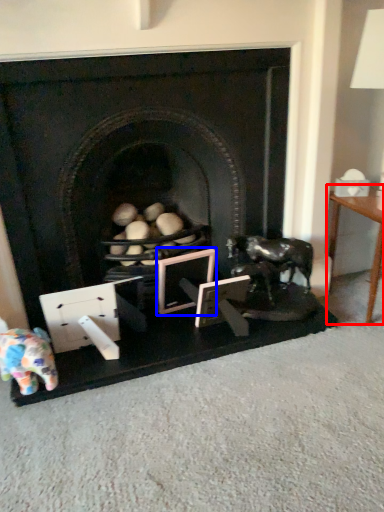
Question: Which of the following is the closest to the observer, table (highlighted by a red box) or picture frame (highlighted by a blue box)?

Choices:
 (A) table
 (B) picture frame

Answer: (A)